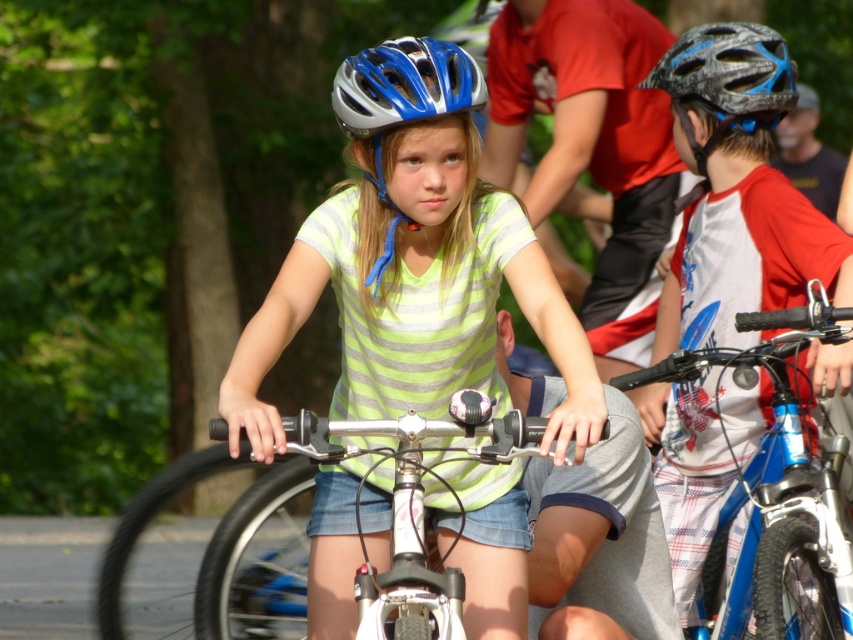
Question: Which object appears closest to the camera in this image?

Choices:
 (A) matte silver helmet at center
 (B) blue metallic helmet at center
 (C) matte plastic helmet at center
 (D) matte black helmet at upper right

Answer: (C)

Question: Can you confirm if matte plastic helmet at center is positioned above matte silver helmet at center?

Choices:
 (A) yes
 (B) no

Answer: (B)

Question: Is matte silver helmet at center closer to camera compared to blue metallic helmet at center?

Choices:
 (A) no
 (B) yes

Answer: (B)

Question: Based on their relative distances, which object is nearer to the matte plastic helmet at center?

Choices:
 (A) blue metallic helmet at center
 (B) matte silver helmet at center
 (C) matte black helmet at upper right
 (D) shiny blue helmet at right

Answer: (B)

Question: Is shiny blue helmet at right positioned behind matte black helmet at upper right?

Choices:
 (A) yes
 (B) no

Answer: (B)

Question: Which object is closer to the camera taking this photo?

Choices:
 (A) matte black helmet at upper right
 (B) blue metallic helmet at center

Answer: (B)